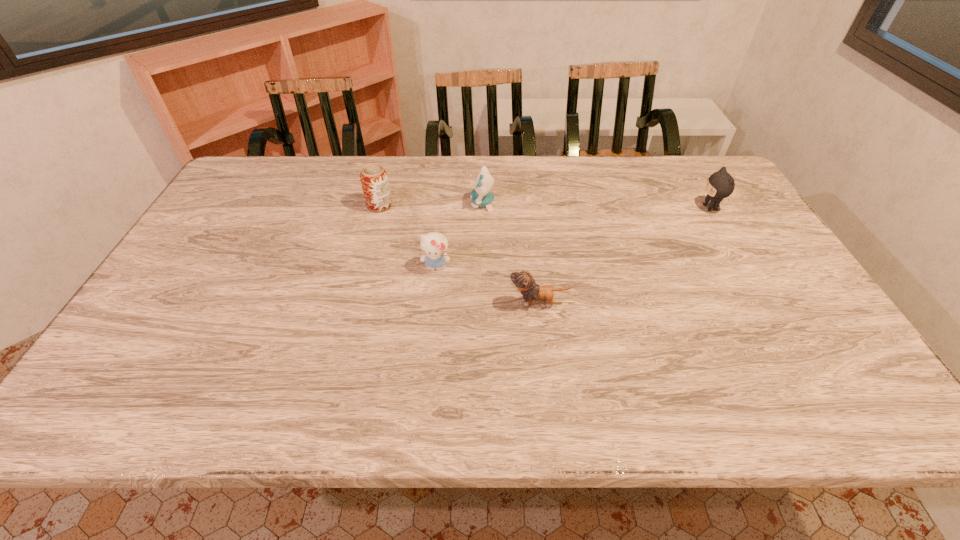
This screenshot has height=540, width=960. Identify the location of vacant space that satisfies the following two spatial constraints: 1. on the front-facing side of the rightmost object; 2. on the front-facing side of the leftmost kitten. (745, 267).

You are a GUI agent. You are given a task and a screenshot of the screen. Output one action in this format:
    pyautogui.click(x=<x>, y=<y>)
    Task: Click on the free space that satisfies the following two spatial constraints: 1. on the face of the third object from left to right; 2. on the front-facing side of the fourth farthest object
    
    Given the screenshot: What is the action you would take?
    pyautogui.click(x=483, y=267)